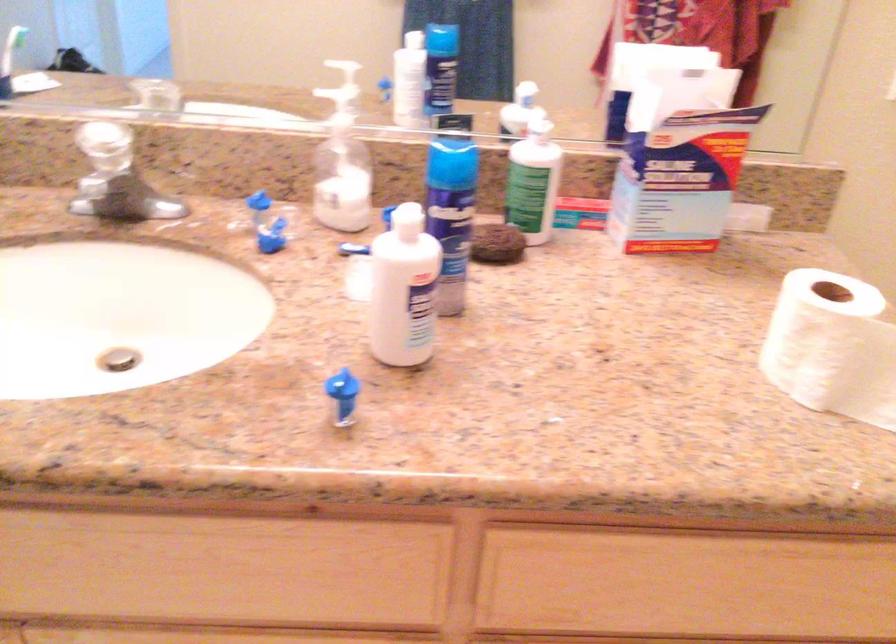
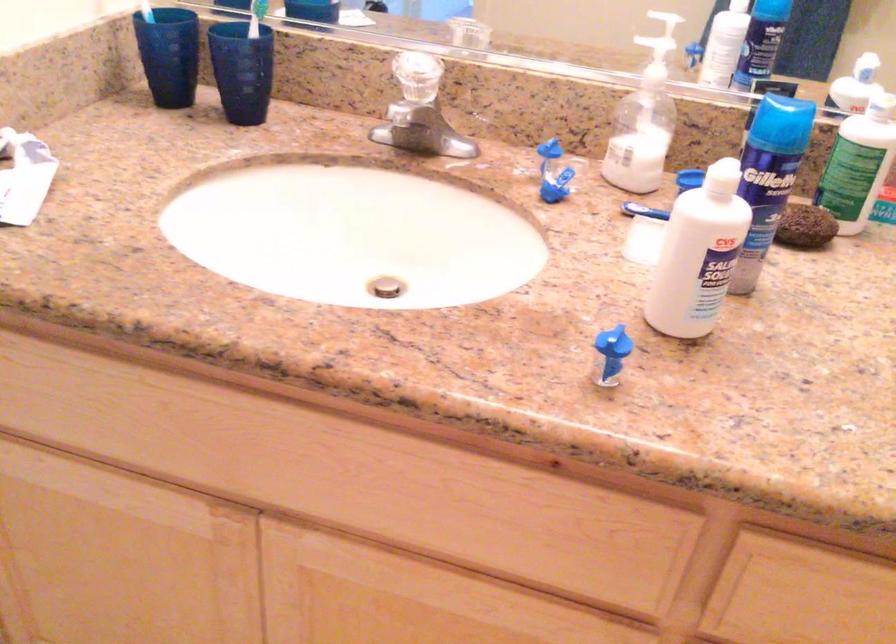
Locate, in the second image, the point that corresponds to pixel 537 181 in the first image.

(858, 164)